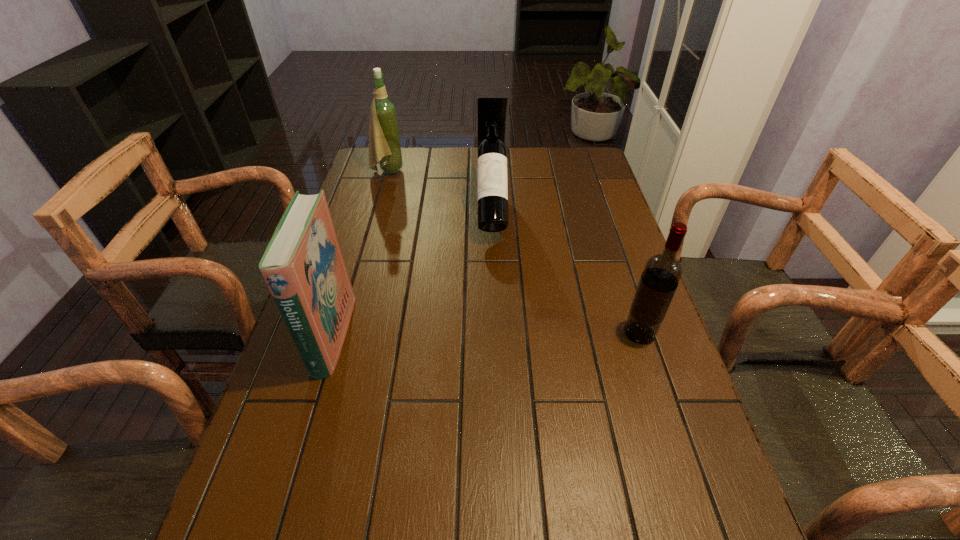
Find the location of a particular element. vacant space situated 0.250m on the front of the nearest wine bottle is located at coordinates (678, 449).

You are a GUI agent. You are given a task and a screenshot of the screen. Output one action in this format:
    pyautogui.click(x=<x>, y=<y>)
    Task: Click on the object that is at the far edge
    The width and height of the screenshot is (960, 540).
    Given the screenshot: What is the action you would take?
    pyautogui.click(x=384, y=141)

This screenshot has height=540, width=960. In order to click on wine bottle that is at the left edge in this screenshot , I will do `click(384, 141)`.

You are a GUI agent. You are given a task and a screenshot of the screen. Output one action in this format:
    pyautogui.click(x=<x>, y=<y>)
    Task: Click on the hardback book present at the left edge
    
    Given the screenshot: What is the action you would take?
    pyautogui.click(x=303, y=266)

The height and width of the screenshot is (540, 960). I want to click on object located at the right edge, so click(662, 272).

I want to click on object present at the far left corner, so click(384, 141).

The image size is (960, 540). What are the coordinates of `blank space at the far edge` in the screenshot? It's located at (546, 173).

This screenshot has width=960, height=540. I want to click on free region at the left edge, so click(259, 462).

Locate an element on the screen. vacant space at the right edge of the desktop is located at coordinates (629, 441).

Find the location of a particular element. The height and width of the screenshot is (540, 960). vacant space at the far left corner of the desktop is located at coordinates (363, 175).